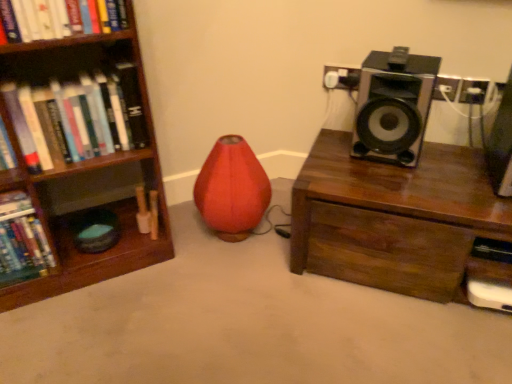
Where is `vacant area situated below metallic silver speaker at upper right, which ranks as the 2th speaker in left-to-right order (from a real-world perspective)`? This screenshot has width=512, height=384. vacant area situated below metallic silver speaker at upper right, which ranks as the 2th speaker in left-to-right order (from a real-world perspective) is located at coordinates (498, 169).